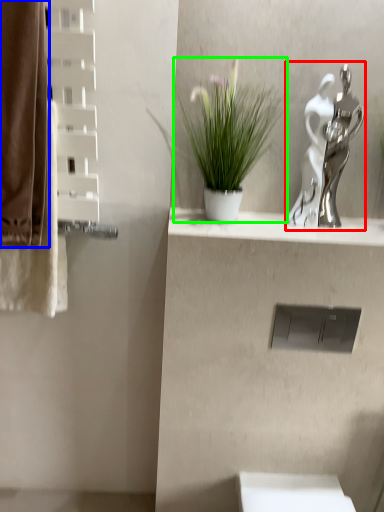
Question: Which object is positioned closest to sculpture (highlighted by a red box)? Select from curtain (highlighted by a blue box) and houseplant (highlighted by a green box).

Choices:
 (A) curtain
 (B) houseplant

Answer: (B)